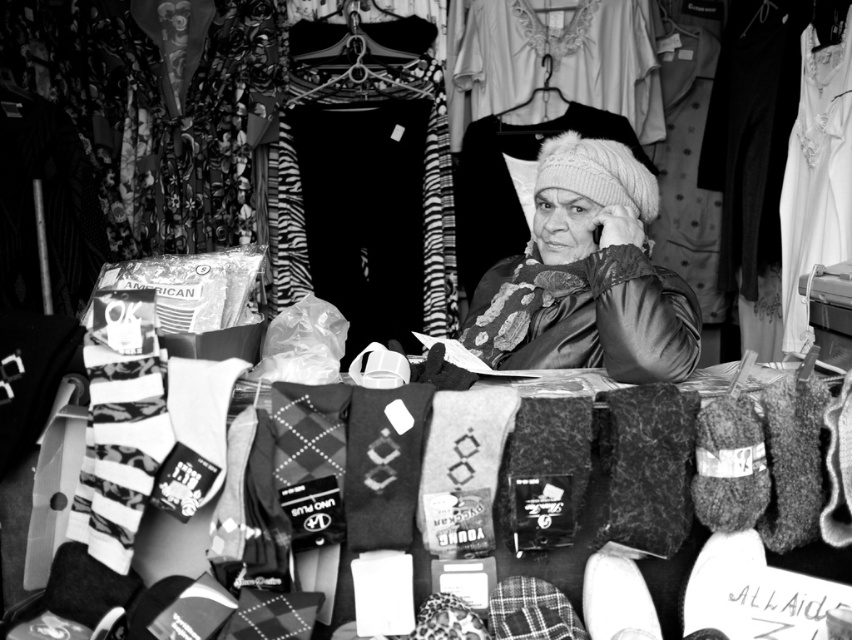
Does white lace blouse at upper center have a greater width compared to fluffy knit hat at center?

Correct, the width of white lace blouse at upper center exceeds that of fluffy knit hat at center.

Is white lace blouse at upper center to the right of fluffy knit hat at center from the viewer's perspective?

Yes, white lace blouse at upper center is to the right of fluffy knit hat at center.

At what (x,y) coordinates should I click in order to perform the action: click on white lace blouse at upper center. Please return your answer as a coordinate pair (x, y). Looking at the image, I should click on (551, 58).

The height and width of the screenshot is (640, 852). I want to click on white lace blouse at upper center, so click(x=551, y=58).

What are the coordinates of `velvet-like black jacket at center` in the screenshot? It's located at (586, 275).

Between point (551, 280) and point (465, 240), which one is positioned in front?

Point (551, 280) is more forward.

Where is `velvet-like black jacket at center`? velvet-like black jacket at center is located at coordinates (586, 275).

At what (x,y) coordinates should I click in order to perform the action: click on velvet-like black jacket at center. Please return your answer as a coordinate pair (x, y). The height and width of the screenshot is (640, 852). Looking at the image, I should click on (586, 275).

Does velvet-like black jacket at center have a smaller size compared to white lace blouse at upper center?

Incorrect, velvet-like black jacket at center is not smaller in size than white lace blouse at upper center.

The height and width of the screenshot is (640, 852). What do you see at coordinates (586, 275) in the screenshot?
I see `velvet-like black jacket at center` at bounding box center [586, 275].

Identify the location of velvet-like black jacket at center. (586, 275).